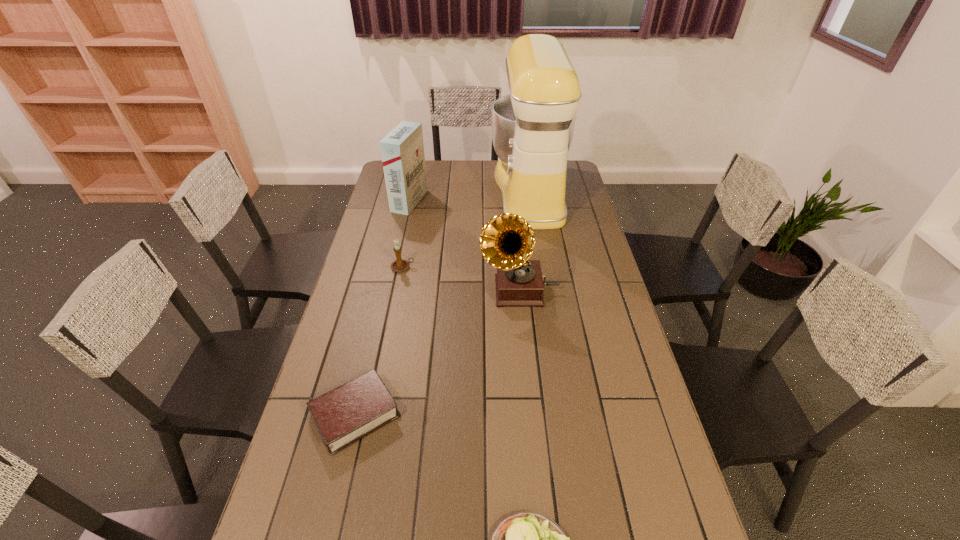
Identify the location of object present at the far right corner. (532, 128).

Where is `blank space at the far edge of the desktop`? blank space at the far edge of the desktop is located at coordinates (488, 167).

The width and height of the screenshot is (960, 540). I want to click on free space at the left edge, so click(360, 288).

The height and width of the screenshot is (540, 960). Identify the location of free region at the right edge of the desktop. (642, 511).

Where is `free spot between the phonograph record and the Bible`? free spot between the phonograph record and the Bible is located at coordinates (438, 352).

At what (x,y) coordinates should I click in order to perform the action: click on vacant space that is in between the phonograph record and the fifth farthest object. Please return your answer as a coordinate pair (x, y). This screenshot has height=540, width=960. Looking at the image, I should click on (438, 352).

I want to click on free space between the candle holder and the phonograph record, so click(461, 279).

This screenshot has height=540, width=960. In order to click on vacant area that lies between the third shortest object and the second nearest object in this screenshot , I will do `click(379, 341)`.

Find the location of `object that is the fifth closest one to the fifth farthest object`. object that is the fifth closest one to the fifth farthest object is located at coordinates tap(402, 150).

Identify the location of object that stands as the closest to the shortest object. The height and width of the screenshot is (540, 960). (527, 539).